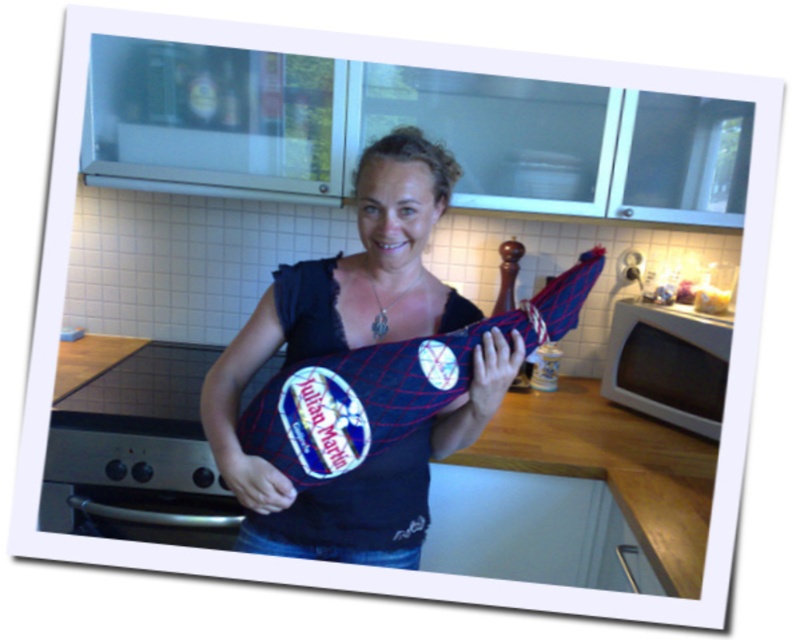
You are a delivery person who just arrived at the kitchen. You need to place a new matte black shirt at center on the counter. Where exactly should you put it?

You should place the matte black shirt at center at point (x=354, y=348).

You are designing a kitchen layout and need to ensure that the matte black shirt at center and the white matte microwave at lower right can be placed side by side without overlapping. Given their widths, will they fit if the total available space is 1.5 meters?

The matte black shirt at center is wider than the white matte microwave at lower right. If their combined widths exceed 1.5 meters, they might not fit. However, since the exact widths aren not provided, it is impossible to determine definitively.